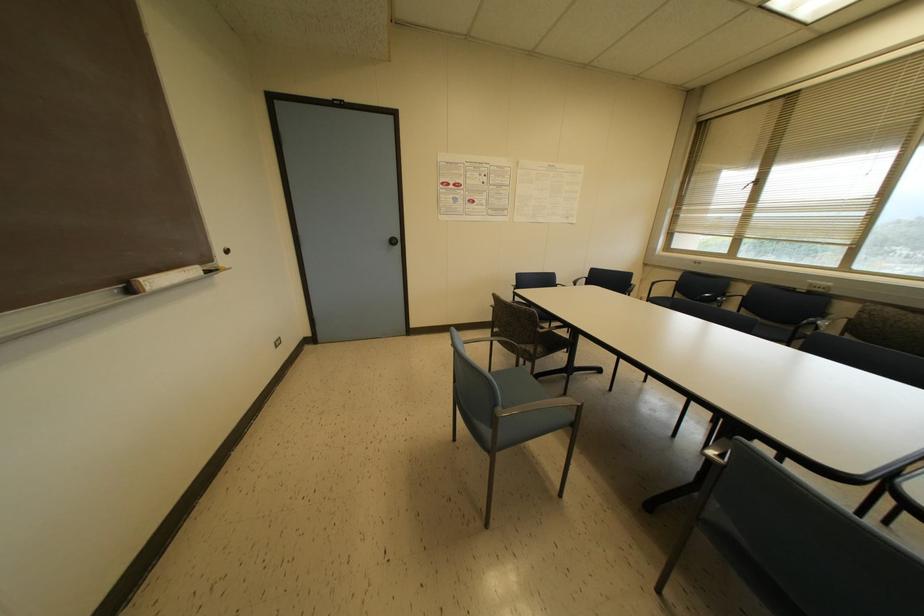
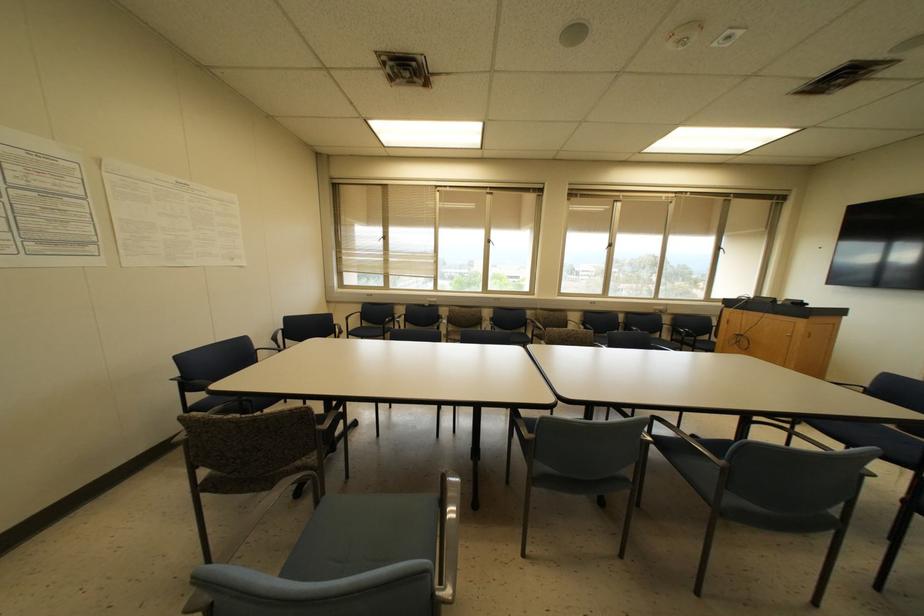
Question: The images are taken continuously from a first-person perspective. In which direction is your viewpoint rotating?

Choices:
 (A) Left
 (B) Right
 (C) Up
 (D) Down

Answer: (B)